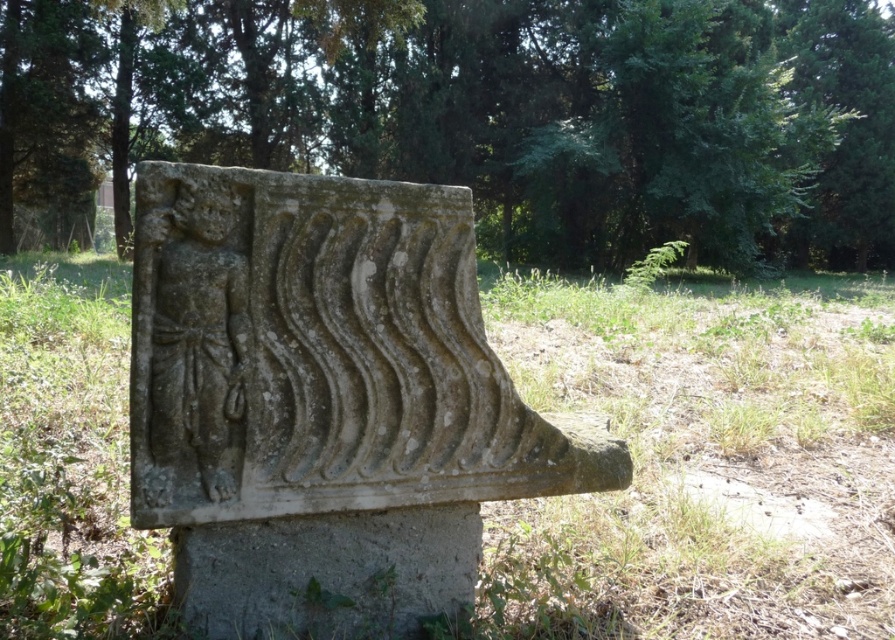
You are an art conservator examining the ancient stone relief sculpture. You notice two stone carvings at the center of the relief. Which one is closer to you, the green stone carving at center or the gray stone carving at center?

The green stone carving at center is closer to you because it is further to the viewer than the gray stone carving at center.